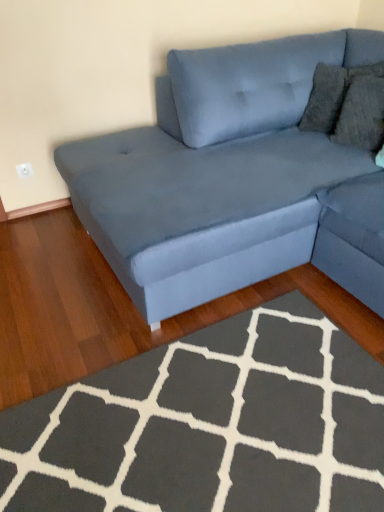
Question: Is dark gray plush rug at lower center inside or outside of velvet blue couch at upper right?

Choices:
 (A) outside
 (B) inside

Answer: (A)

Question: From the image's perspective, is dark gray plush rug at lower center positioned above or below velvet blue couch at upper right?

Choices:
 (A) below
 (B) above

Answer: (A)

Question: Does point pyautogui.click(x=205, y=384) appear closer or farther from the camera than point pyautogui.click(x=342, y=257)?

Choices:
 (A) closer
 (B) farther

Answer: (A)

Question: From the image's perspective, is velvet blue couch at upper right above or below dark gray plush rug at lower center?

Choices:
 (A) below
 (B) above

Answer: (B)

Question: Does point (105, 153) appear closer or farther from the camera than point (271, 471)?

Choices:
 (A) closer
 (B) farther

Answer: (B)

Question: Considering the relative positions of velvet blue couch at upper right and dark gray plush rug at lower center in the image provided, is velvet blue couch at upper right to the left or to the right of dark gray plush rug at lower center?

Choices:
 (A) right
 (B) left

Answer: (A)

Question: Which is correct: velvet blue couch at upper right is inside dark gray plush rug at lower center, or outside of it?

Choices:
 (A) outside
 (B) inside

Answer: (A)